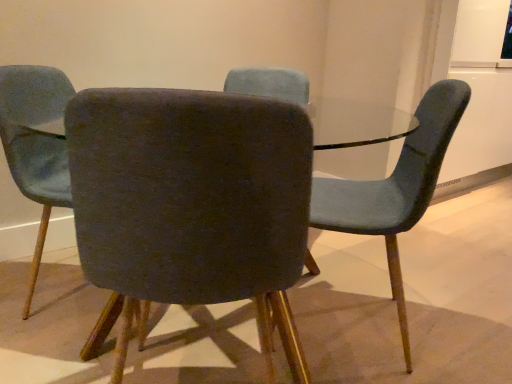
Question: Based on their sizes in the image, would you say velvet teal chair at right, the third chair from the left, is bigger or smaller than velvet dark gray chair at center, acting as the 2th chair starting from the right?

Choices:
 (A) big
 (B) small

Answer: (B)

Question: Is velvet teal chair at right, the third chair from the left, wider or thinner than velvet dark gray chair at center, acting as the 2th chair starting from the right?

Choices:
 (A) wide
 (B) thin

Answer: (B)

Question: Which is nearer to the velvet dark gray chair at center, the second chair from the left?

Choices:
 (A) velvet dark gray chair at center, which appears as the third chair when viewed from the right
 (B) velvet teal chair at right, acting as the 1th chair starting from the right

Answer: (B)

Question: Which of these objects is positioned closest to the velvet teal chair at right, the third chair from the left?

Choices:
 (A) velvet dark gray chair at center, acting as the 2th chair starting from the right
 (B) velvet dark gray chair at center, marked as the 1th chair in a left-to-right arrangement

Answer: (A)